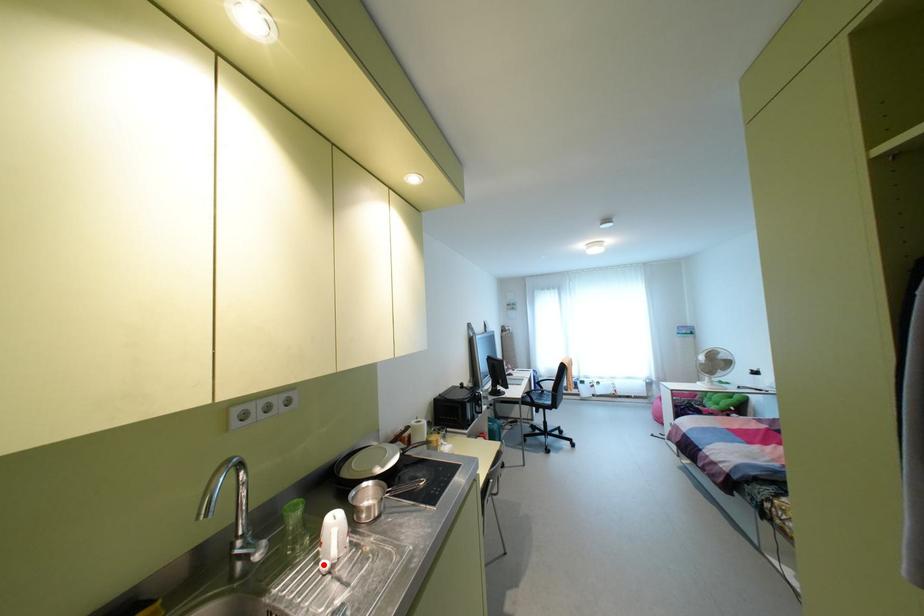
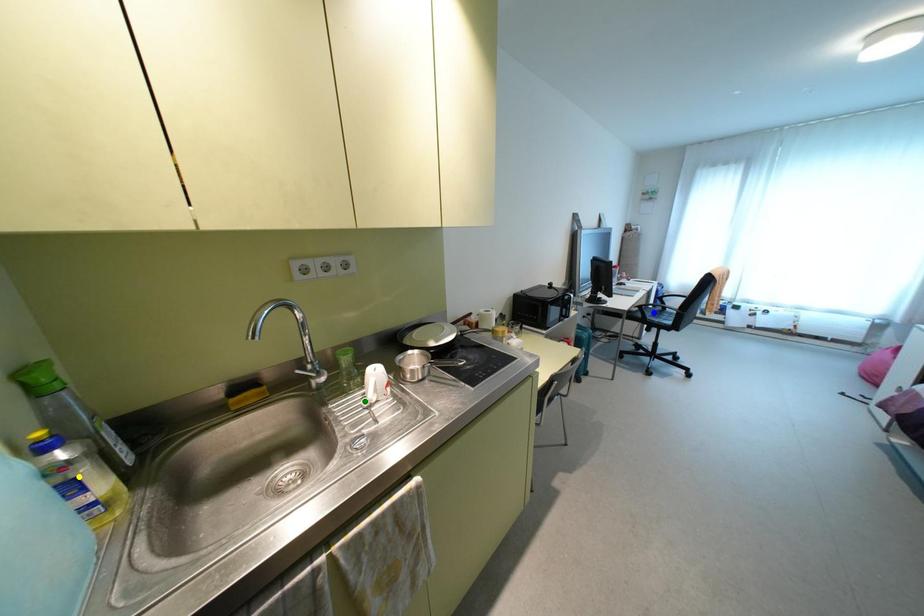
Question: I am providing you with two images of the same scene from different viewpoints. A red point is marked on the first image. You are given multiple points on the second image. Can you choose the point in image 2 that corresponds to the point in image 1?

Choices:
 (A) blue point
 (B) yellow point
 (C) green point

Answer: (C)